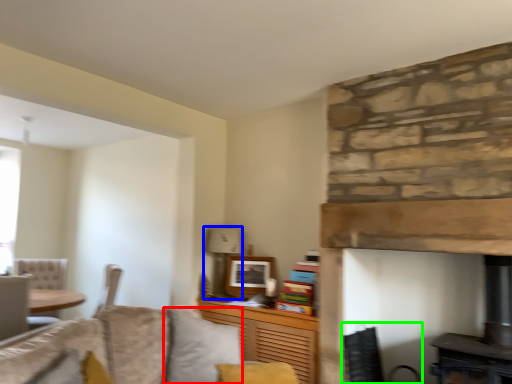
Question: Estimate the real-world distances between objects in this image. Which object is farther from pillow (highlighted by a red box), lamp (highlighted by a blue box) or swivel chair (highlighted by a green box)?

Choices:
 (A) lamp
 (B) swivel chair

Answer: (A)